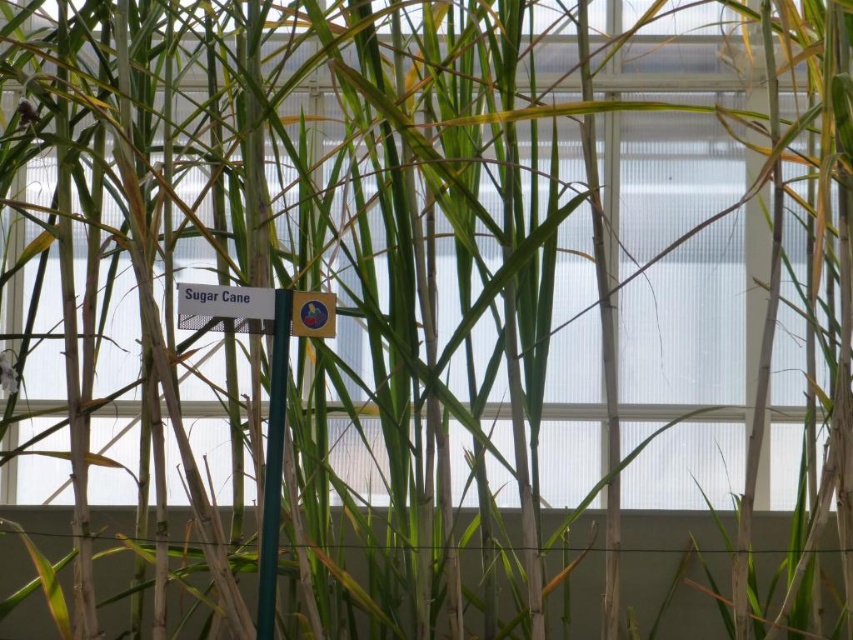
Looking at this image, is green matte pole at center above matte plastic sign at center?

No, green matte pole at center is not above matte plastic sign at center.

Who is more forward, (280, 310) or (318, 324)?

Point (280, 310)

The height and width of the screenshot is (640, 853). In order to click on green matte pole at center in this screenshot , I will do `click(273, 465)`.